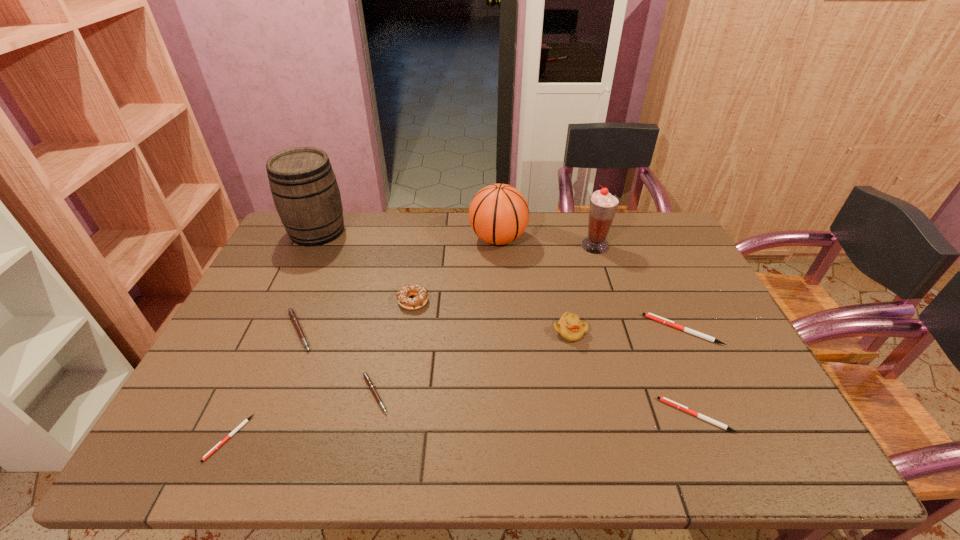
Locate an element on the screen. Image resolution: width=960 pixels, height=540 pixels. empty space between the nearer pink pen and the smoothie is located at coordinates (485, 320).

Identify which object is the sixth nearest to the chocolate doughnut. Please provide its 2D coordinates. Your answer should be formatted as a tuple, i.e. [(x, y)], where the tuple contains the x and y coordinates of a point satisfying the conditions above.

[(245, 421)]

Locate an element on the screen. This screenshot has width=960, height=540. object that stands as the fourth closest to the basketball is located at coordinates tap(657, 318).

Select which pen appears as the fourth closest to the biggest white pen. Please provide its 2D coordinates. Your answer should be formatted as a tuple, i.e. [(x, y)], where the tuple contains the x and y coordinates of a point satisfying the conditions above.

[(245, 421)]

Locate which pen is the fourth closest to the second biggest white pen. Please provide its 2D coordinates. Your answer should be formatted as a tuple, i.e. [(x, y)], where the tuple contains the x and y coordinates of a point satisfying the conditions above.

[(245, 421)]

At what (x,y) coordinates should I click in order to perform the action: click on white pen that is the closest to the bigger pink pen. Please return your answer as a coordinate pair (x, y). Looking at the image, I should click on (245, 421).

Image resolution: width=960 pixels, height=540 pixels. Identify the location of white pen that stands as the second closest to the farthest white pen. (245, 421).